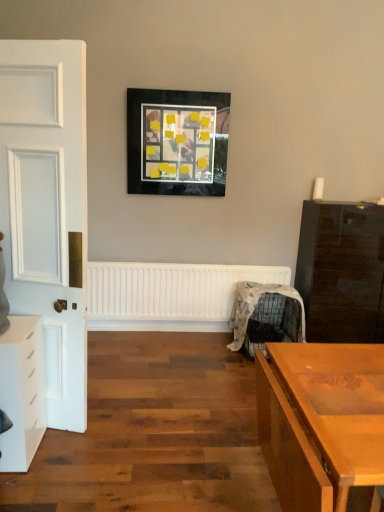
Question: Is metallic wire swivel chair at center-right positioned beyond the bounds of glossy dark wood chest of drawers at right, which is the first chest of drawers from back to front?

Choices:
 (A) no
 (B) yes

Answer: (B)

Question: Considering the relative sizes of metallic wire swivel chair at center-right and glossy dark wood chest of drawers at right, which ranks as the 1th chest of drawers in right-to-left order, in the image provided, is metallic wire swivel chair at center-right taller than glossy dark wood chest of drawers at right, which ranks as the 1th chest of drawers in right-to-left order,?

Choices:
 (A) yes
 (B) no

Answer: (B)

Question: Could you tell me if metallic wire swivel chair at center-right is facing glossy dark wood chest of drawers at right, which ranks as the 1th chest of drawers in right-to-left order?

Choices:
 (A) yes
 (B) no

Answer: (B)

Question: From the image's perspective, is metallic wire swivel chair at center-right located beneath glossy dark wood chest of drawers at right, which is the first chest of drawers from back to front?

Choices:
 (A) yes
 (B) no

Answer: (A)

Question: Does metallic wire swivel chair at center-right appear on the right side of glossy dark wood chest of drawers at right, the 2th chest of drawers when ordered from left to right?

Choices:
 (A) yes
 (B) no

Answer: (B)

Question: Would you say metallic wire swivel chair at center-right contains glossy dark wood chest of drawers at right, the 2th chest of drawers when ordered from left to right?

Choices:
 (A) yes
 (B) no

Answer: (B)

Question: Is white matte radiator at center not inside glossy dark wood chest of drawers at right, which is counted as the second chest of drawers, starting from the front?

Choices:
 (A) no
 (B) yes

Answer: (B)

Question: Considering the relative sizes of white matte radiator at center and glossy dark wood chest of drawers at right, which is counted as the second chest of drawers, starting from the front, in the image provided, is white matte radiator at center taller than glossy dark wood chest of drawers at right, which is counted as the second chest of drawers, starting from the front,?

Choices:
 (A) yes
 (B) no

Answer: (B)

Question: Is white matte radiator at center thinner than glossy dark wood chest of drawers at right, which ranks as the 1th chest of drawers in right-to-left order?

Choices:
 (A) no
 (B) yes

Answer: (B)

Question: Does white matte radiator at center lie in front of glossy dark wood chest of drawers at right, which ranks as the 1th chest of drawers in right-to-left order?

Choices:
 (A) yes
 (B) no

Answer: (B)

Question: From a real-world perspective, is white matte radiator at center positioned over glossy dark wood chest of drawers at right, which is counted as the second chest of drawers, starting from the front, based on gravity?

Choices:
 (A) yes
 (B) no

Answer: (B)

Question: From the image's perspective, is white matte radiator at center under glossy dark wood chest of drawers at right, the 2th chest of drawers when ordered from left to right?

Choices:
 (A) yes
 (B) no

Answer: (A)

Question: Is there a large distance between glossy dark wood chest of drawers at right, which is counted as the second chest of drawers, starting from the front, and matte black picture frame at upper center?

Choices:
 (A) no
 (B) yes

Answer: (B)